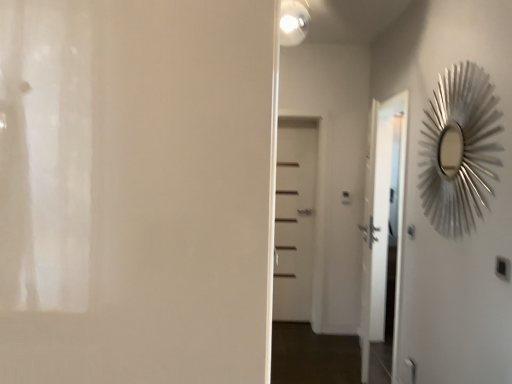
Question: Are white glossy light fixture at upper center and white matte door at center, placed as the 1th door when sorted from right to left, far apart?

Choices:
 (A) no
 (B) yes

Answer: (B)

Question: Is white glossy light fixture at upper center turned away from white matte door at center, which is counted as the 2th door, starting from the left?

Choices:
 (A) no
 (B) yes

Answer: (A)

Question: Could you tell me if white glossy light fixture at upper center is turned towards white matte door at center, which is counted as the 2th door, starting from the left?

Choices:
 (A) yes
 (B) no

Answer: (B)

Question: Considering the relative sizes of white glossy light fixture at upper center and white matte door at center, which is counted as the 2th door, starting from the left, in the image provided, is white glossy light fixture at upper center smaller than white matte door at center, which is counted as the 2th door, starting from the left,?

Choices:
 (A) yes
 (B) no

Answer: (A)

Question: Does white glossy light fixture at upper center have a larger size compared to white matte door at center, arranged as the second door when viewed from the front?

Choices:
 (A) yes
 (B) no

Answer: (B)

Question: From a real-world perspective, is silver metallic sunburst mirror at right positioned above or below white matte door at center, placed as the 1th door when sorted from right to left?

Choices:
 (A) below
 (B) above

Answer: (B)

Question: Choose the correct answer: Is silver metallic sunburst mirror at right inside white matte door at center, the first door positioned from the back, or outside it?

Choices:
 (A) outside
 (B) inside

Answer: (A)

Question: Looking at the image, does silver metallic sunburst mirror at right seem bigger or smaller compared to white matte door at center, the first door positioned from the back?

Choices:
 (A) big
 (B) small

Answer: (A)

Question: Considering the positions of point (376, 261) and point (288, 286), is point (376, 261) closer or farther from the camera than point (288, 286)?

Choices:
 (A) closer
 (B) farther

Answer: (A)

Question: Relative to white matte door at center, the second door viewed from the right, is silver metallic sunburst mirror at right in front or behind?

Choices:
 (A) front
 (B) behind

Answer: (B)

Question: Considering the positions of silver metallic sunburst mirror at right and white matte door at center, positioned as the 2th door in back-to-front order, in the image, is silver metallic sunburst mirror at right wider or thinner than white matte door at center, positioned as the 2th door in back-to-front order,?

Choices:
 (A) wide
 (B) thin

Answer: (B)

Question: Does point (399, 105) appear closer or farther from the camera than point (250, 336)?

Choices:
 (A) closer
 (B) farther

Answer: (B)

Question: Based on their positions, is silver metallic sunburst mirror at right located to the left or right of white matte door at center, the second door viewed from the right?

Choices:
 (A) right
 (B) left

Answer: (A)

Question: In terms of width, does white matte door at center, positioned as the 1th door in front-to-back order, look wider or thinner when compared to white matte door at center, placed as the 1th door when sorted from right to left?

Choices:
 (A) thin
 (B) wide

Answer: (B)

Question: From the image's perspective, is white matte door at center, positioned as the 1th door in front-to-back order, positioned above or below white matte door at center, placed as the 1th door when sorted from right to left?

Choices:
 (A) above
 (B) below

Answer: (A)